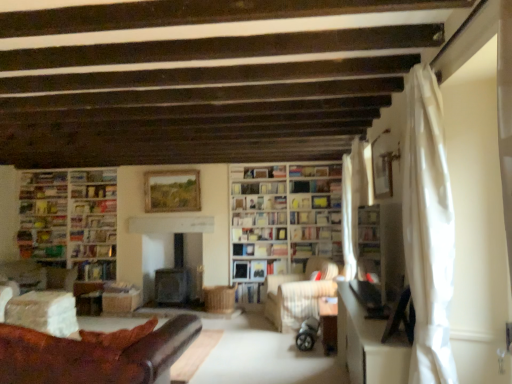
Question: Is point (303, 230) closer or farther from the camera than point (248, 233)?

Choices:
 (A) closer
 (B) farther

Answer: (A)

Question: In the image, is hardcover book at center, the seventh book when ordered from left to right, positioned in front of or behind hardcover book at center, which is the 5th book from left to right?

Choices:
 (A) front
 (B) behind

Answer: (A)

Question: Estimate the real-world distances between objects in this image. Which object is farther from the wooden picture frame at center?

Choices:
 (A) hardcover book at left, placed as the 6th book when sorted from right to left
 (B) hardcover book at center, which is counted as the first book, starting from the right
 (C) white paper bookshelf at center, the fourth book viewed from the right
 (D) white glossy bookcase at center, the 2th bookcase in the left-to-right sequence
 (E) white sheer curtain at right, which appears as the first curtain when viewed from the front

Answer: (E)

Question: Which object is positioned closest to the white glossy bookcase at center, the 1th bookcase when ordered from right to left?

Choices:
 (A) hardcover book at center, positioned as the seventh book in right-to-left order
 (B) white paper bookshelf at center, the fourth book viewed from the right
 (C) wooden bookshelf at center, placed as the second shelf when sorted from left to right
 (D) hardcover book at center, the 3th book from the right
 (E) leather couch at lower left

Answer: (B)